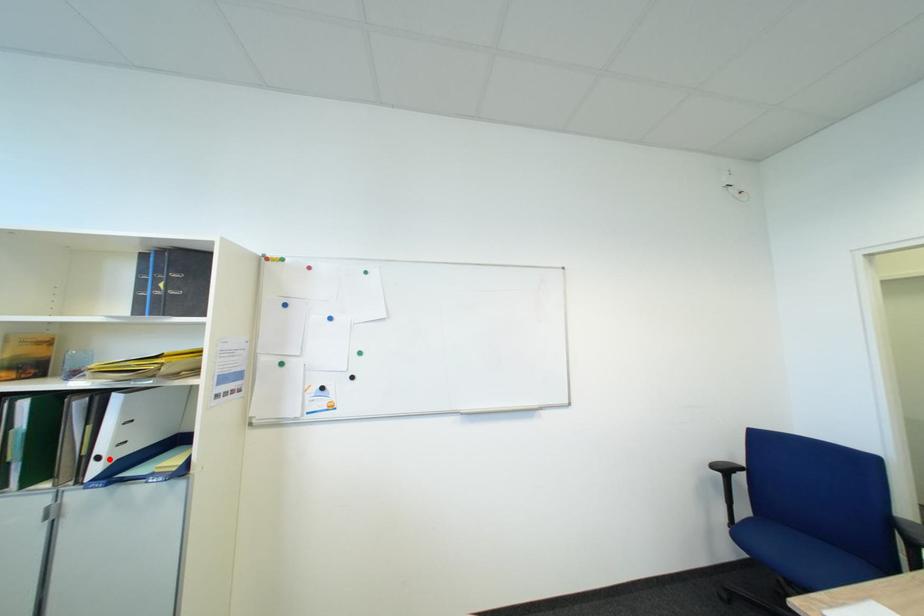
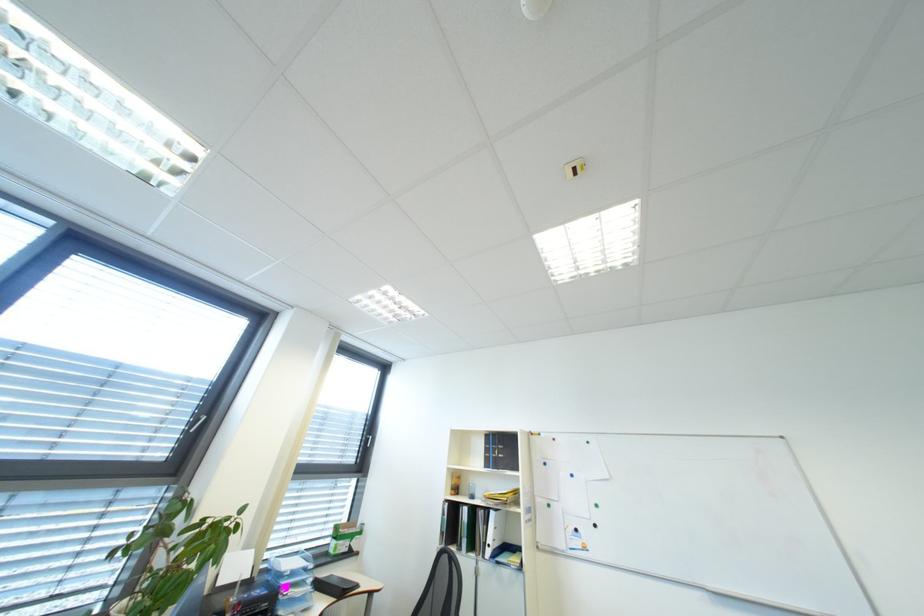
Where in the second image is the point corresponding to the highlighted location from the first image?

(500, 546)